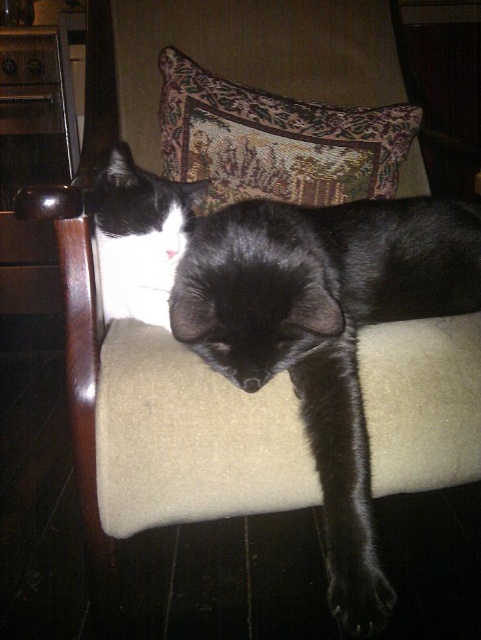
Question: Is the position of black fur cat at center less distant than that of velvet tapestry pillow at upper center?

Choices:
 (A) yes
 (B) no

Answer: (A)

Question: Is black fur cat at center wider than velvet tapestry pillow at upper center?

Choices:
 (A) yes
 (B) no

Answer: (B)

Question: Is black fur cat at center bigger than velvet tapestry pillow at upper center?

Choices:
 (A) yes
 (B) no

Answer: (A)

Question: Estimate the real-world distances between objects in this image. Which object is farther from the black matte paw at lower center?

Choices:
 (A) black fur cat at center
 (B) white fur/black fur cat at upper left
 (C) velvet tapestry pillow at upper center

Answer: (C)

Question: Which of the following is the farthest from the observer?

Choices:
 (A) (354, 611)
 (B) (157, 227)
 (C) (212, 163)
 (D) (402, 266)

Answer: (C)

Question: Which object appears closest to the camera in this image?

Choices:
 (A) black matte paw at lower center
 (B) white fur/black fur cat at upper left

Answer: (A)